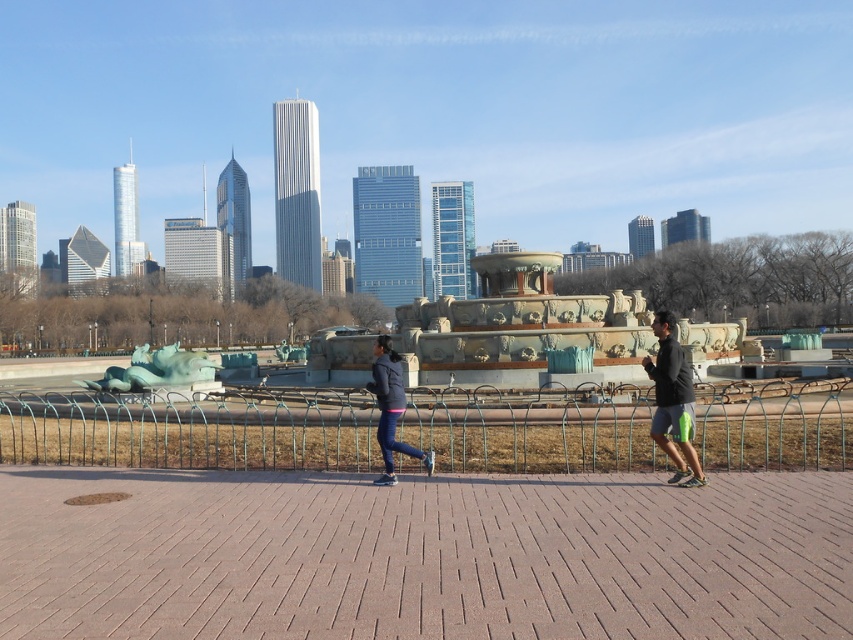
Question: Is dark gray fabric jacket at right to the left of matte black jacket at center from the viewer's perspective?

Choices:
 (A) yes
 (B) no

Answer: (B)

Question: Which point is closer to the camera?

Choices:
 (A) dark gray fabric jacket at right
 (B) green metal fence at center

Answer: (A)

Question: Can you confirm if green metal fence at center is bigger than dark gray fabric jacket at right?

Choices:
 (A) yes
 (B) no

Answer: (A)

Question: Does green metal fence at center come behind matte black jacket at center?

Choices:
 (A) no
 (B) yes

Answer: (B)

Question: Which of the following is the closest to the observer?

Choices:
 (A) dark gray fabric jacket at right
 (B) green metal fence at center
 (C) matte black jacket at center

Answer: (A)

Question: Which object is farther from the camera taking this photo?

Choices:
 (A) matte black jacket at center
 (B) dark gray fabric jacket at right

Answer: (A)